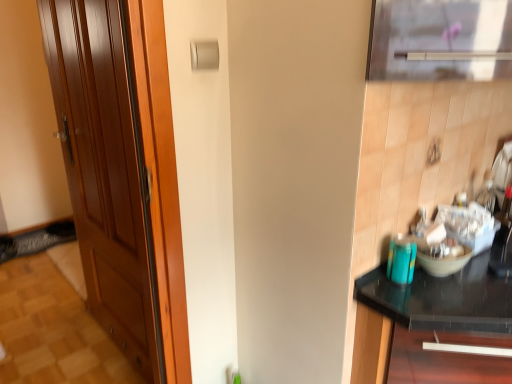
At what (x,y) coordinates should I click in order to perform the action: click on shiny brown door at left. Please return your answer as a coordinate pair (x, y). The height and width of the screenshot is (384, 512). Looking at the image, I should click on (122, 173).

This screenshot has height=384, width=512. What do you see at coordinates (122, 173) in the screenshot?
I see `shiny brown door at left` at bounding box center [122, 173].

The width and height of the screenshot is (512, 384). Find the location of `black glass countertop at right`. black glass countertop at right is located at coordinates (444, 297).

Measure the distance between point (450, 278) and camera.

They are 1.14 meters apart.

What do you see at coordinates (444, 297) in the screenshot? I see `black glass countertop at right` at bounding box center [444, 297].

Where is `shiny brown door at left`? The image size is (512, 384). shiny brown door at left is located at coordinates (122, 173).

In the image, is black glass countertop at right on the left side or the right side of shiny brown door at left?

Result: black glass countertop at right is to the right of shiny brown door at left.

Considering the positions of objects black glass countertop at right and shiny brown door at left in the image provided, who is behind, black glass countertop at right or shiny brown door at left?

shiny brown door at left.

Does point (433, 316) come closer to viewer compared to point (170, 223)?

Yes, point (433, 316) is closer to viewer.

From the image's perspective, is black glass countertop at right under shiny brown door at left?

Correct, black glass countertop at right appears lower than shiny brown door at left in the image.

From a real-world perspective, which is physically below, black glass countertop at right or shiny brown door at left?

From a 3D spatial view, black glass countertop at right is below.

Which object is thinner, black glass countertop at right or shiny brown door at left?

Thinner between the two is shiny brown door at left.

Looking at this image, is black glass countertop at right taller than shiny brown door at left?

No.

Consider the image. Between black glass countertop at right and shiny brown door at left, which one has smaller size?

shiny brown door at left is smaller.

Is black glass countertop at right positioned beyond the bounds of shiny brown door at left?

black glass countertop at right is positioned outside shiny brown door at left.

Is black glass countertop at right touching shiny brown door at left?

black glass countertop at right and shiny brown door at left are clearly separated.

Is black glass countertop at right facing away from shiny brown door at left?

Yes, black glass countertop at right's orientation is away from shiny brown door at left.

How many degrees apart are the facing directions of black glass countertop at right and shiny brown door at left?

black glass countertop at right and shiny brown door at left are facing 91.5 degrees away from each other.

Find the location of a particular element. This screenshot has width=512, height=384. door that is on the left side of black glass countertop at right is located at coordinates (122, 173).

Consider the image. Considering the positions of objects shiny brown door at left and black glass countertop at right in the image provided, who is more to the right, shiny brown door at left or black glass countertop at right?

black glass countertop at right is more to the right.

Does shiny brown door at left lie behind black glass countertop at right?

Yes, shiny brown door at left is further from the camera.

Considering the points (143, 108) and (492, 253), which point is behind, point (143, 108) or point (492, 253)?

The point (492, 253) is more distant.

From the image's perspective, does shiny brown door at left appear lower than black glass countertop at right?

No, from the image's perspective, shiny brown door at left is not beneath black glass countertop at right.

From a real-world perspective, who is located lower, shiny brown door at left or black glass countertop at right?

From a 3D spatial view, black glass countertop at right is below.

Between shiny brown door at left and black glass countertop at right, which one has larger width?

With larger width is black glass countertop at right.

From the picture: From their relative heights in the image, would you say shiny brown door at left is taller or shorter than black glass countertop at right?

Clearly, shiny brown door at left is taller compared to black glass countertop at right.

Considering the relative sizes of shiny brown door at left and black glass countertop at right in the image provided, is shiny brown door at left bigger than black glass countertop at right?

Actually, shiny brown door at left might be smaller than black glass countertop at right.

Is shiny brown door at left located outside black glass countertop at right?

Yes, shiny brown door at left is not within black glass countertop at right.

Are shiny brown door at left and black glass countertop at right beside each other?

There is a gap between shiny brown door at left and black glass countertop at right.

Is shiny brown door at left aimed at black glass countertop at right?

No, shiny brown door at left is not turned towards black glass countertop at right.

How much distance is there between shiny brown door at left and black glass countertop at right?

shiny brown door at left is 39.36 inches from black glass countertop at right.

Locate an element on the screen. This screenshot has height=384, width=512. door lying above the black glass countertop at right (from the image's perspective) is located at coordinates (122, 173).

What are the coordinates of `countertop lying below the shiny brown door at left (from the image's perspective)` in the screenshot? It's located at (444, 297).

The width and height of the screenshot is (512, 384). In order to click on door above the black glass countertop at right (from the image's perspective) in this screenshot , I will do `click(122, 173)`.